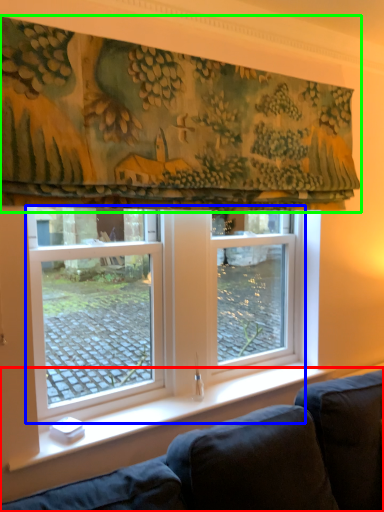
Question: Which is farther away from studio couch (highlighted by a red box)? window (highlighted by a blue box) or curtain (highlighted by a green box)?

Choices:
 (A) window
 (B) curtain

Answer: (B)